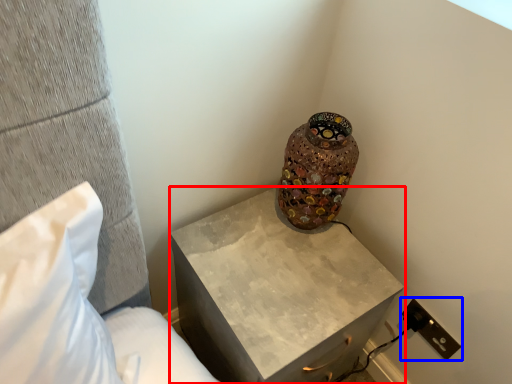
Question: Which object appears farthest to the camera in this image, nightstand (highlighted by a red box) or electric outlet (highlighted by a blue box)?

Choices:
 (A) nightstand
 (B) electric outlet

Answer: (B)